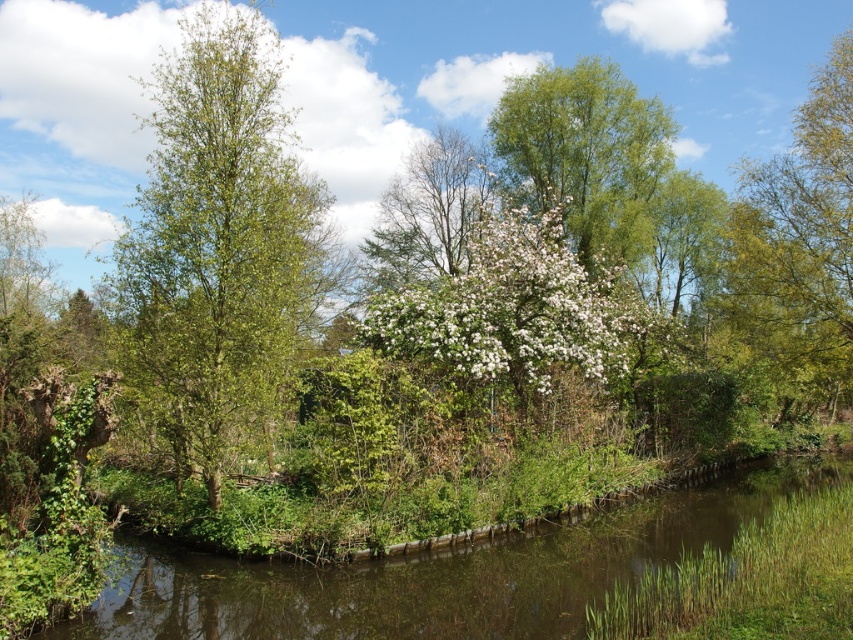
Question: Is green grassy river at lower center above green leafy tree at upper right?

Choices:
 (A) no
 (B) yes

Answer: (A)

Question: Is green leafy tree at upper right bigger than green leafy tree at upper center?

Choices:
 (A) no
 (B) yes

Answer: (B)

Question: Which of the following is the farthest from the observer?

Choices:
 (A) white blossoming tree at center
 (B) green grassy river at lower center

Answer: (A)

Question: Which point is farther to the camera?

Choices:
 (A) (206, 150)
 (B) (787, 408)
 (C) (598, 180)
 (D) (416, 244)

Answer: (D)

Question: Can you confirm if green grassy river at lower center is thinner than green leafy tree at upper center?

Choices:
 (A) no
 (B) yes

Answer: (A)

Question: Which of the following is the farthest from the observer?

Choices:
 (A) (746, 243)
 (B) (396, 275)
 (C) (247, 49)
 (D) (538, 573)

Answer: (B)